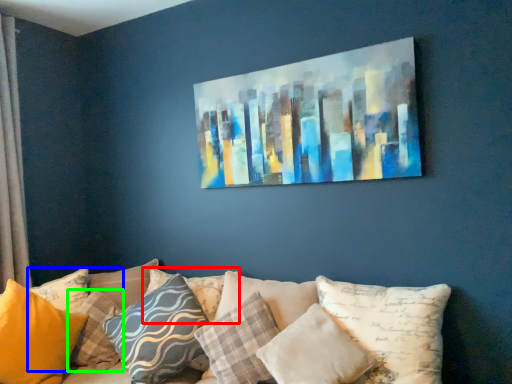
Question: Considering the real-world distances, which object is farthest from pillow (highlighted by a red box)? pillow (highlighted by a blue box) or pillow (highlighted by a green box)?

Choices:
 (A) pillow
 (B) pillow

Answer: (A)